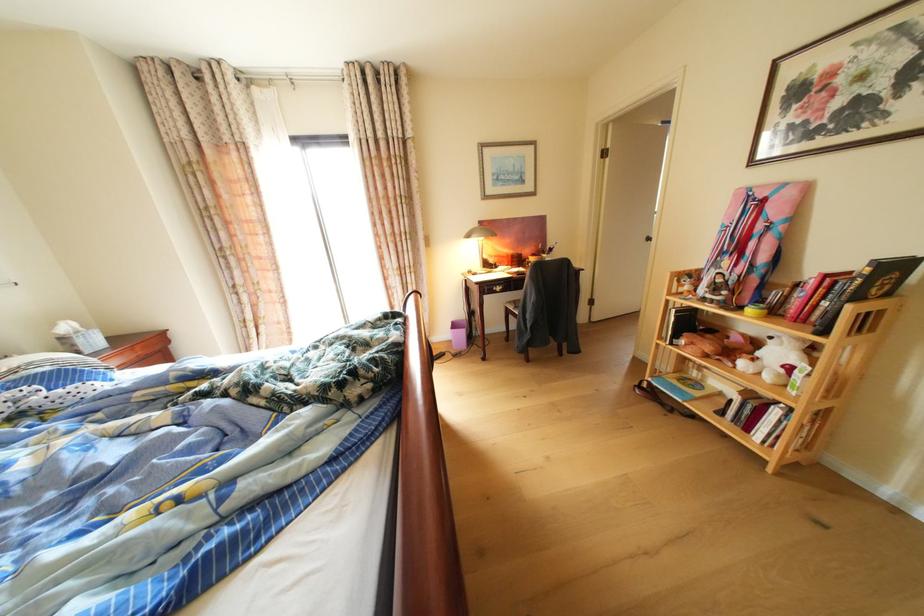
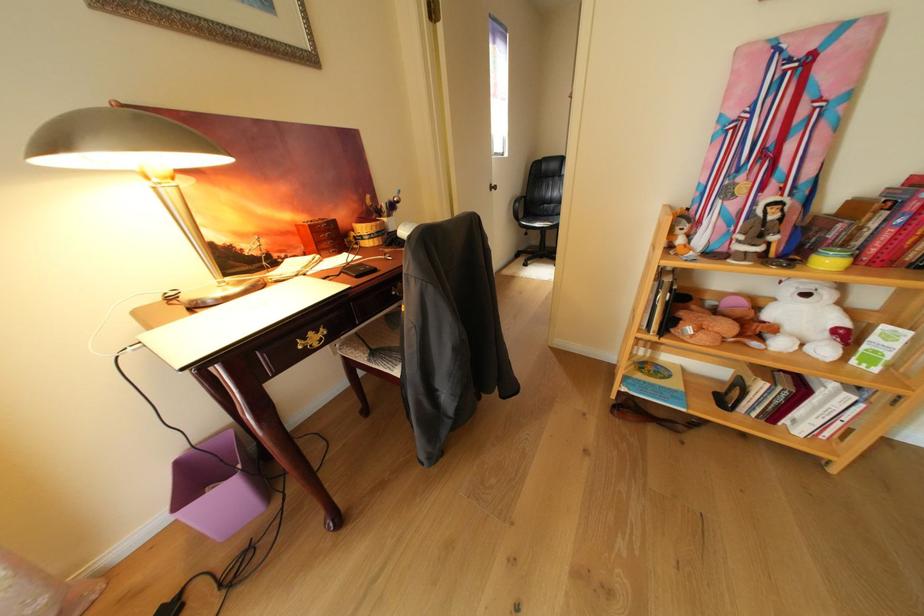
In the second image, find the point that corresponds to point (695, 282) in the first image.

(689, 230)